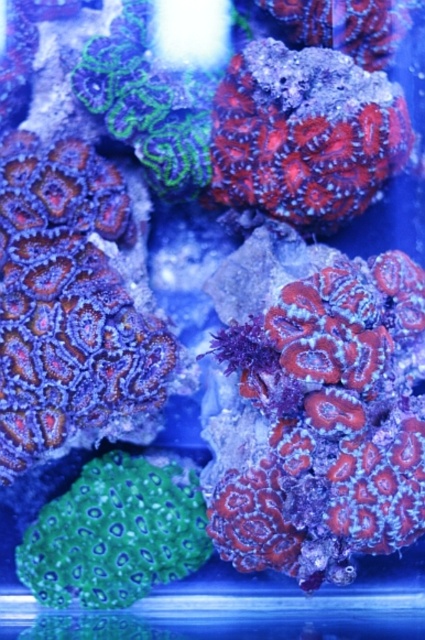
Who is more forward, (x=380, y=545) or (x=308, y=180)?

Point (x=380, y=545)

Is point (323, 307) positioned behind point (343, 67)?

That is False.

Measure the distance between point (x=371, y=342) and camera.

Point (x=371, y=342) and camera are 1.31 meters apart from each other.

This screenshot has height=640, width=425. What are the coordinates of `smooth coral at center` in the screenshot? It's located at (323, 422).

Between shiny coral at center and green textured coral at lower left, which one has more height?

shiny coral at center is taller.

Does point (410, 131) come in front of point (178, 557)?

Yes, point (410, 131) is in front of point (178, 557).

Locate an element on the screen. shiny coral at center is located at coordinates (305, 132).

Can you confirm if smooth coral at center is positioned below green textured coral at lower left?

Actually, smooth coral at center is above green textured coral at lower left.

Is smooth coral at center to the right of green textured coral at lower left from the viewer's perspective?

Yes, smooth coral at center is to the right of green textured coral at lower left.

The width and height of the screenshot is (425, 640). Identify the location of smooth coral at center. (323, 422).

The height and width of the screenshot is (640, 425). Identify the location of smooth coral at center. (323, 422).